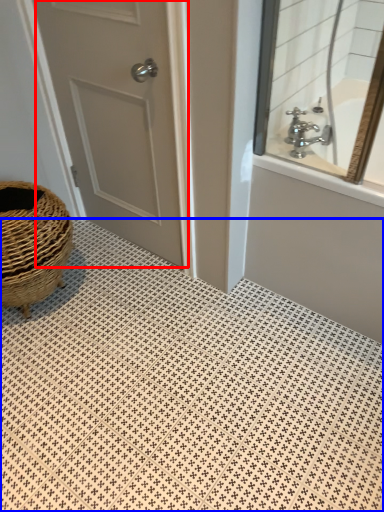
Question: Which point is closer to the camera, door (highlighted by a red box) or pattern (highlighted by a blue box)?

Choices:
 (A) door
 (B) pattern

Answer: (B)